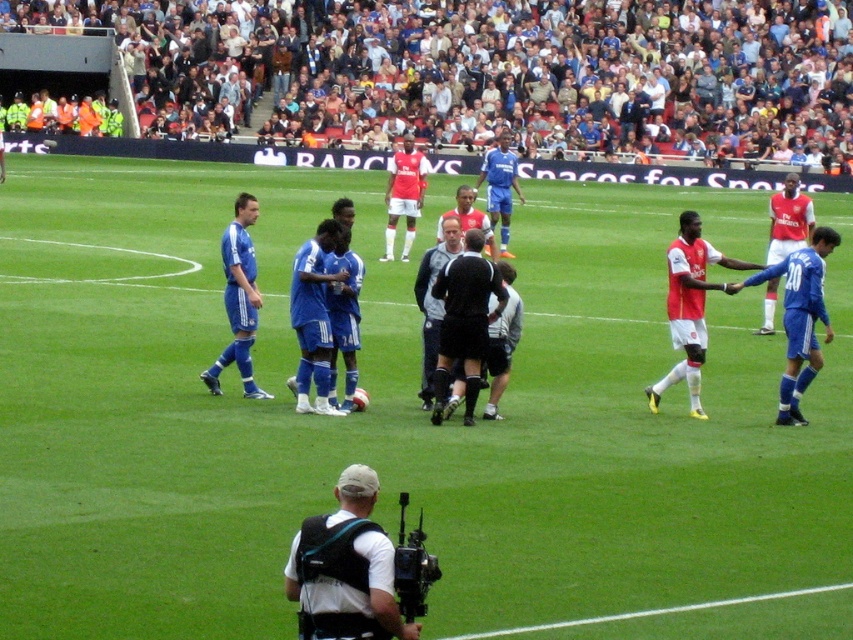
You are a drone operator tasked with capturing aerial footage of the soccer match. The multicolored fabric crowd at upper center is your main focus. Where should you position the drone to ensure the crowd is centered in the frame?

The multicolored fabric crowd at upper center is located at point (486, 72), so you should position the drone at coordinates approximately 0.114 on the x axis and 0.572 on the y axis to center the crowd in the frame.

You are a soccer player on the field and want to pass the ball to your teammate wearing the matte red jersey at center. However, there is a multicolored fabric crowd at upper center blocking your view. Can you see your teammate through the crowd?

The matte red jersey at center is behind the multicolored fabric crowd at upper center, so you cannot see your teammate through the crowd.

You are a soccer player standing on the field and need to pass the ball to your teammate wearing the matte red jersey at center. The black uniformed official at center is blocking your direct path. What is the minimum distance you need to move around the official to reach your teammate?

The black uniformed official at center and matte red jersey at center are 5.35 feet apart. To pass around the official, you need to move at least 5.35 feet to ensure the ball reaches your teammate without obstruction.